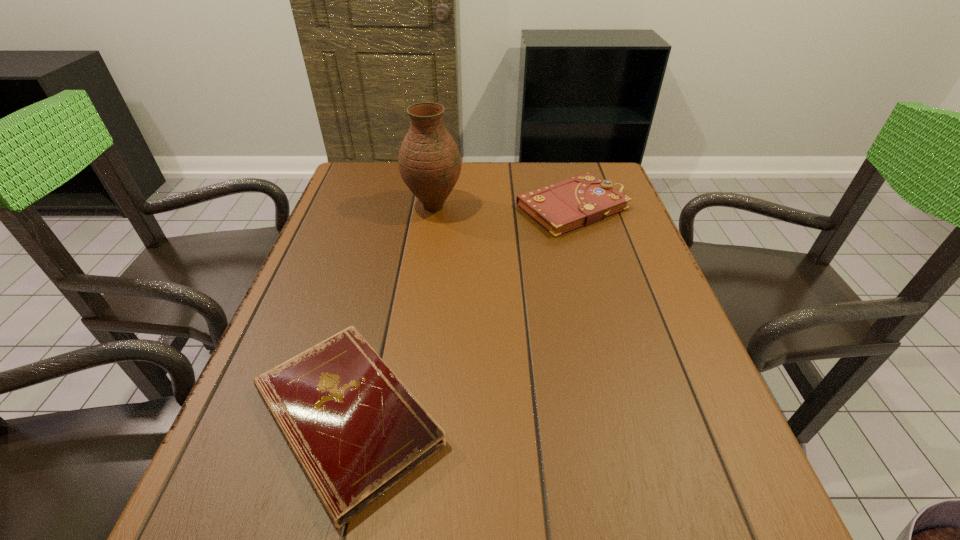
Where is `vacant space that is in between the left notebook and the vase`? The image size is (960, 540). vacant space that is in between the left notebook and the vase is located at coordinates (390, 312).

Identify the location of the closest object relative to the vase. This screenshot has width=960, height=540. (581, 200).

This screenshot has width=960, height=540. Find the location of `object identified as the closest to the rightmost object`. object identified as the closest to the rightmost object is located at coordinates (429, 160).

Locate an element on the screen. This screenshot has width=960, height=540. free space that satisfies the following two spatial constraints: 1. on the back side of the shortest object; 2. on the left side of the vase is located at coordinates (398, 207).